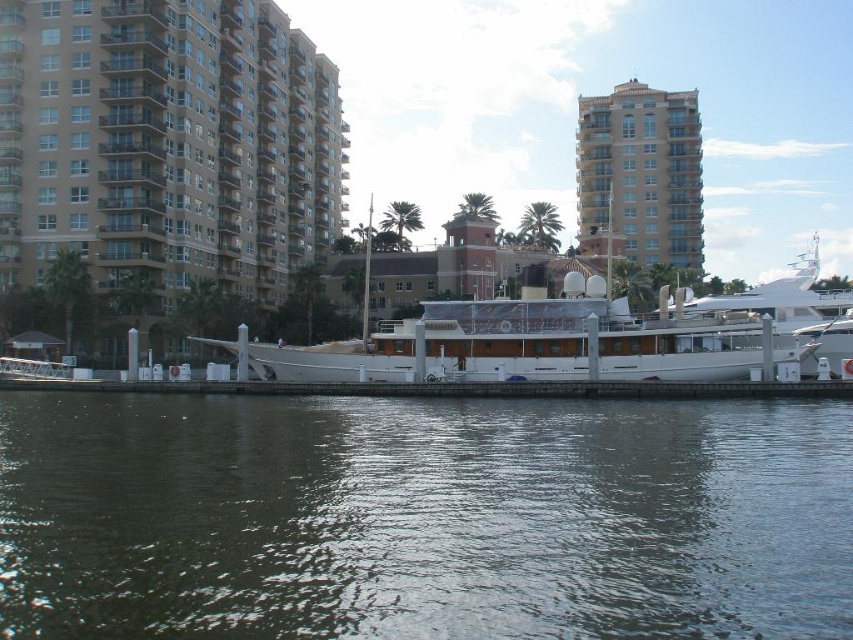
Is white polished wood boat at center thinner than tan/brick-like building at upper right?

No.

Which is below, white polished wood boat at center or tan/brick-like building at upper right?

white polished wood boat at center

Identify the location of white polished wood boat at center. The image size is (853, 640). (556, 337).

From the picture: Does tan/brick-like building at upper right appear on the left side of white glossy yacht at right?

Yes, tan/brick-like building at upper right is to the left of white glossy yacht at right.

Which is more to the left, tan/brick-like building at upper right or white glossy yacht at right?

Positioned to the left is tan/brick-like building at upper right.

Does point (688, 93) come farther from viewer compared to point (766, 316)?

Yes, point (688, 93) is farther from viewer.

The image size is (853, 640). In order to click on tan/brick-like building at upper right in this screenshot , I will do `click(641, 172)`.

Can you confirm if beige concrete building at left is positioned to the left of tan/brick-like building at upper right?

Correct, you'll find beige concrete building at left to the left of tan/brick-like building at upper right.

Does point (41, 220) come farther from viewer compared to point (672, 193)?

No, it is in front of (672, 193).

You are a GUI agent. You are given a task and a screenshot of the screen. Output one action in this format:
    pyautogui.click(x=<x>, y=<y>)
    Task: Click on the beige concrete building at left
    The width and height of the screenshot is (853, 640).
    Given the screenshot: What is the action you would take?
    pyautogui.click(x=167, y=144)